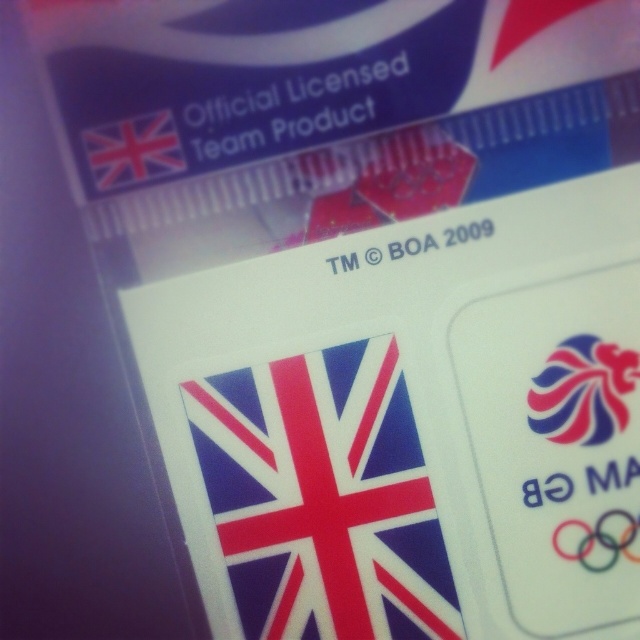
Is blue glossy logo at upper right wider than matte plastic flag at upper left?

Correct, the width of blue glossy logo at upper right exceeds that of matte plastic flag at upper left.

Locate an element on the screen. This screenshot has width=640, height=640. blue glossy logo at upper right is located at coordinates (582, 390).

Does matte plastic flag at center have a smaller size compared to blue glossy logo at upper right?

Incorrect, matte plastic flag at center is not smaller in size than blue glossy logo at upper right.

What do you see at coordinates (323, 497) in the screenshot? I see `matte plastic flag at center` at bounding box center [323, 497].

Between point (212, 433) and point (611, 385), which one is positioned behind?

The point (212, 433) is more distant.

Find the location of a particular element. matte plastic flag at center is located at coordinates [x=323, y=497].

Does matte plastic flag at center appear under matte plastic flag at upper left?

Indeed, matte plastic flag at center is positioned under matte plastic flag at upper left.

Is point (294, 364) farther from camera compared to point (108, 152)?

Yes, it is.

This screenshot has width=640, height=640. Identify the location of matte plastic flag at center. (323, 497).